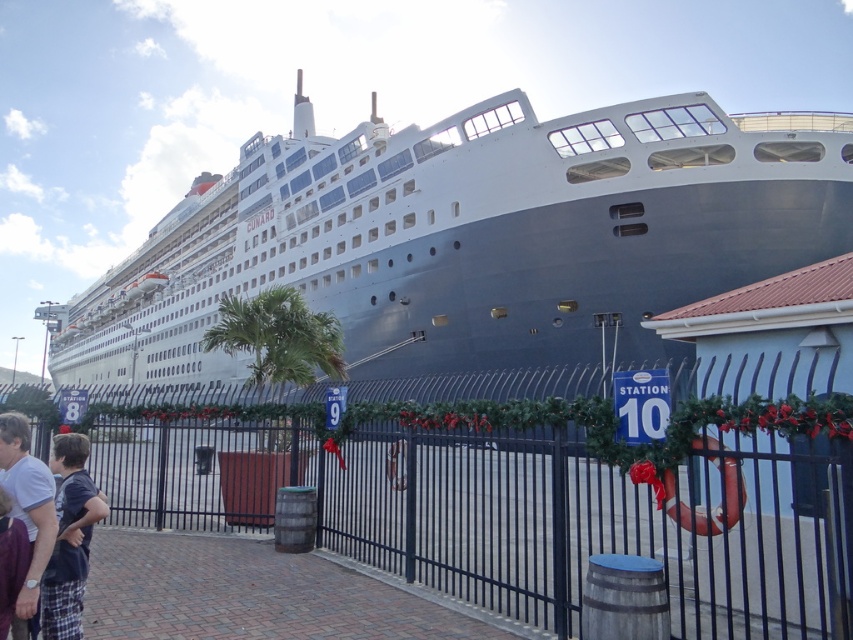
Question: Which object is closer to the camera taking this photo?

Choices:
 (A) black metal fence at center
 (B) dark blue cotton shirt at lower left
 (C) white glossy cruise ship at center

Answer: (A)

Question: Which of the following is the closest to the observer?

Choices:
 (A) dark blue cotton shirt at lower left
 (B) black metal fence at center

Answer: (B)

Question: Does white glossy cruise ship at center appear on the left side of black metal fence at center?

Choices:
 (A) no
 (B) yes

Answer: (B)

Question: Which object is closer to the camera taking this photo?

Choices:
 (A) dark blue cotton shirt at lower left
 (B) black metal fence at center

Answer: (B)

Question: Is white glossy cruise ship at center smaller than black metal fence at center?

Choices:
 (A) yes
 (B) no

Answer: (B)

Question: Is the position of white glossy cruise ship at center less distant than that of black metal fence at center?

Choices:
 (A) yes
 (B) no

Answer: (B)